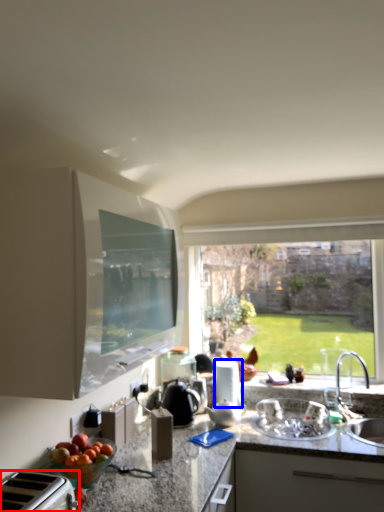
Question: Which point is further to the camera, appliance (highlighted by a red box) or appliance (highlighted by a blue box)?

Choices:
 (A) appliance
 (B) appliance

Answer: (B)